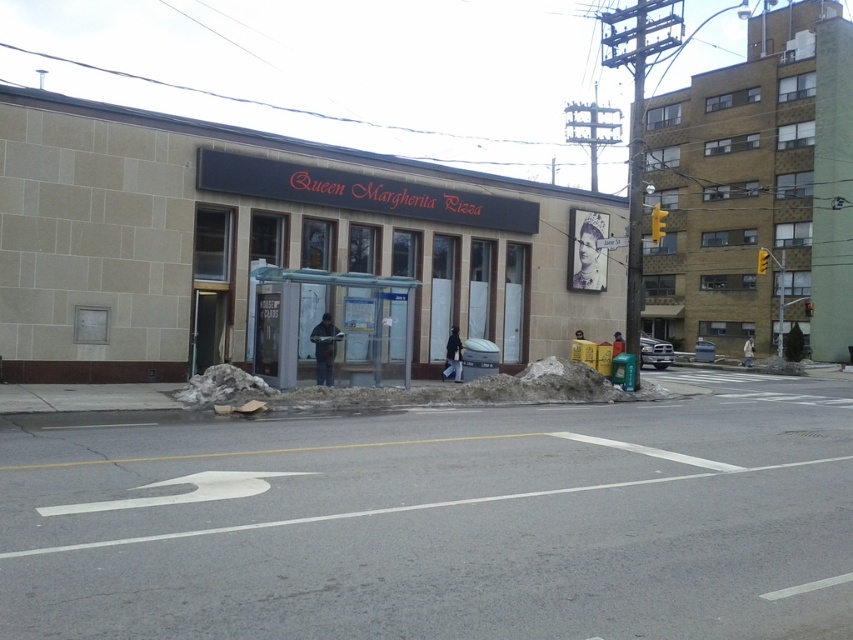
You are a delivery person trying to locate the address for Queen Margherita Pizza. You see the beige stone building at center and the black matte sign at center. Which one should you approach to find the correct address?

The beige stone building at center is positioned over the black matte sign at center, indicating that the sign is likely part of the building. Approach the beige stone building at center for the correct address.

You are a delivery person needing to find the Queen Margherita Pizza location. You see the black matte sign at center and the white snow at center. Which object is closer to the left side of the image?

The black matte sign at center is to the left of white snow at center, so it is closer to the left side of the image.